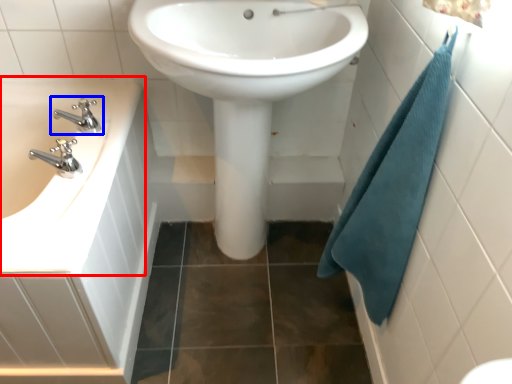
Question: Which object is further to the camera taking this photo, sink (highlighted by a red box) or tap (highlighted by a blue box)?

Choices:
 (A) sink
 (B) tap

Answer: (B)